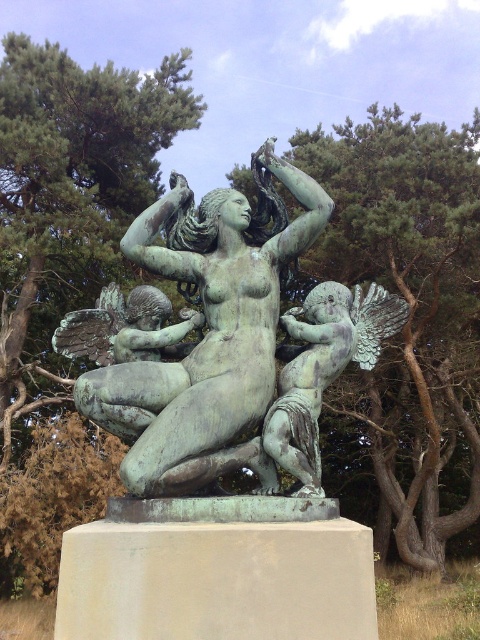
Question: Which point is closer to the camera?

Choices:
 (A) (265, 250)
 (B) (4, 232)
 (C) (418, 188)

Answer: (A)

Question: Which point appears closest to the camera in this image?

Choices:
 (A) 400,467
 (B) 199,221
 (C) 278,404

Answer: (C)

Question: Which point is farther from the camera taking this photo?

Choices:
 (A) (48, 376)
 (B) (346, 292)

Answer: (A)

Question: Can you confirm if green textured tree at upper left is positioned above green patina bronze statue at center?

Choices:
 (A) yes
 (B) no

Answer: (A)

Question: Does green textured tree at upper left appear over green patina bronze statue at center?

Choices:
 (A) yes
 (B) no

Answer: (A)

Question: Is green textured tree at center positioned in front of green patina bronze statue at center?

Choices:
 (A) no
 (B) yes

Answer: (A)